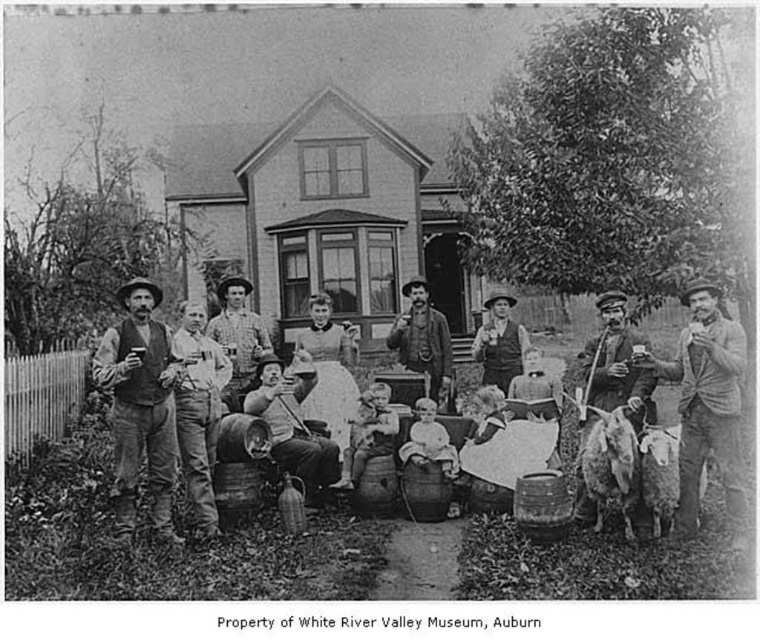
You are a photographer standing at the camera position. You want to take a closeup shot of the smooth wooden pipe at right. Is it possible to reach the pipe without moving from your current position?

The smooth wooden pipe at right is 6.63 meters from the camera, so it is possible to take a closeup shot without moving from the current position if you have a zoom lens capable of focusing at that distance.

You are a tailor who needs to store a smooth leather jacket at right and a smooth wooden barrel at center. Given their thickness, which object would require a wider storage space?

The smooth wooden barrel at center requires a wider storage space because it is thicker than the smooth leather jacket at right.